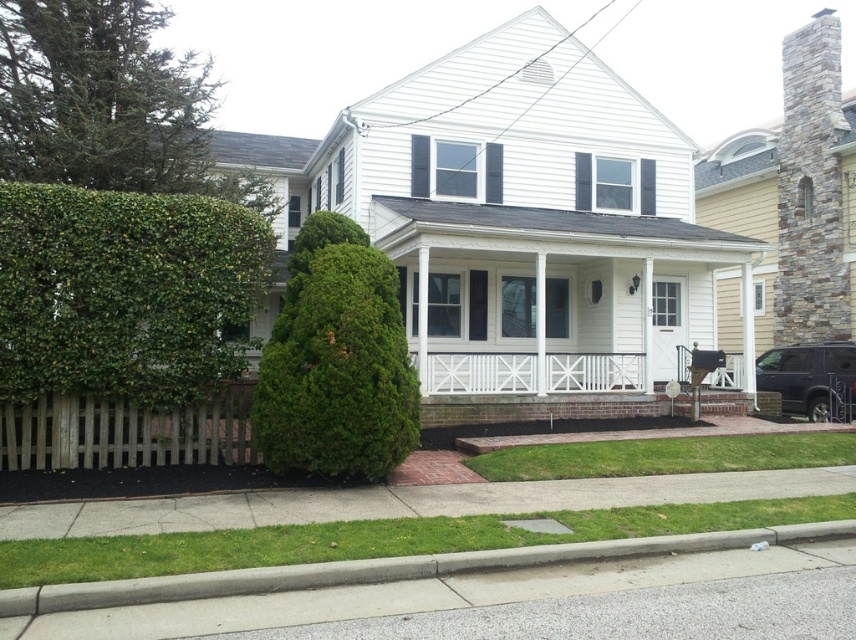
Can you confirm if green leafy hedge at left is taller than gray concrete curb at lower center?

Correct, green leafy hedge at left is much taller as gray concrete curb at lower center.

Is point (87, 317) positioned before point (346, 564)?

That is False.

At what (x,y) coordinates should I click in order to perform the action: click on green leafy hedge at left. Please return your answer as a coordinate pair (x, y). Looking at the image, I should click on (125, 292).

Between green leafy hedge at left and green textured hedge at center, which one is positioned lower?

green textured hedge at center is below.

Does green leafy hedge at left have a lesser width compared to green textured hedge at center?

No, green leafy hedge at left is not thinner than green textured hedge at center.

Locate an element on the screen. The image size is (856, 640). green leafy hedge at left is located at coordinates (125, 292).

Image resolution: width=856 pixels, height=640 pixels. Identify the location of green leafy hedge at left. (125, 292).

Between point (336, 349) and point (259, 586), which one is positioned in front?

Positioned in front is point (259, 586).

Is point (340, 474) positioned after point (82, 605)?

That is True.

Is point (415, 438) farther from camera compared to point (804, 540)?

Yes, it is behind point (804, 540).

Where is `green textured hedge at center`? Image resolution: width=856 pixels, height=640 pixels. green textured hedge at center is located at coordinates (336, 362).